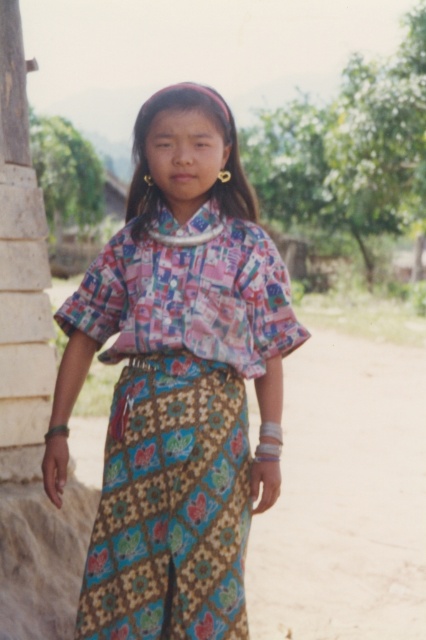
Question: Is printed fabric blouse at center positioned behind brown dirt field at lower center?

Choices:
 (A) yes
 (B) no

Answer: (B)

Question: Does printed fabric blouse at center have a greater width compared to brown dirt field at lower center?

Choices:
 (A) no
 (B) yes

Answer: (A)

Question: Which point is farther to the camera?

Choices:
 (A) brown dirt field at lower center
 (B) printed fabric blouse at center

Answer: (A)

Question: Among these objects, which one is nearest to the camera?

Choices:
 (A) printed fabric blouse at center
 (B) brown dirt field at lower center

Answer: (A)

Question: Which object is farther from the camera taking this photo?

Choices:
 (A) brown dirt field at lower center
 (B) printed fabric blouse at center

Answer: (A)

Question: Can you confirm if printed fabric blouse at center is wider than brown dirt field at lower center?

Choices:
 (A) no
 (B) yes

Answer: (A)